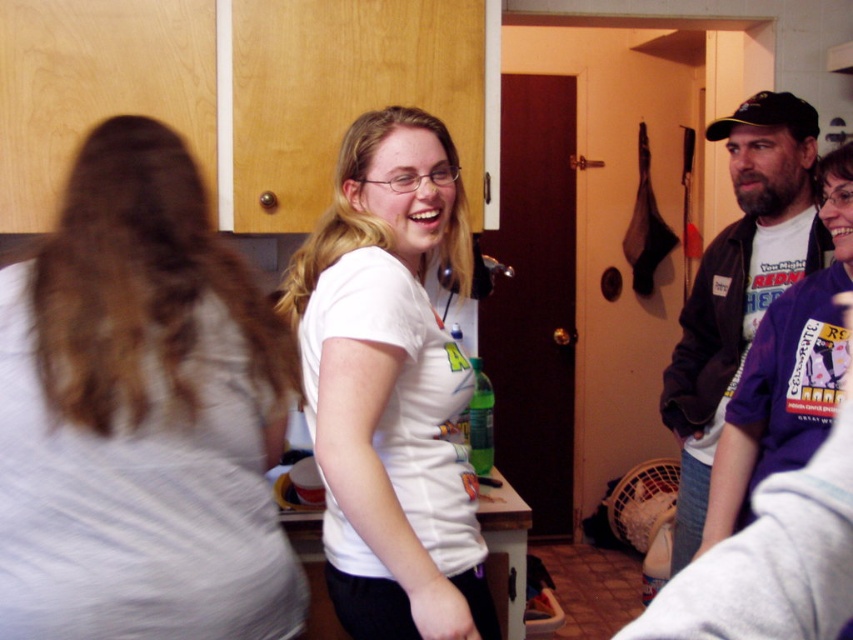
Question: Which object appears closest to the camera in this image?

Choices:
 (A) light gray cotton shirt at center
 (B) dark brown leather jacket at right
 (C) white matte t-shirt at center

Answer: (A)

Question: Is light gray cotton shirt at center bigger than white matte t-shirt at center?

Choices:
 (A) no
 (B) yes

Answer: (A)

Question: Which object is the farthest from the dark brown leather jacket at right?

Choices:
 (A) light gray cotton shirt at center
 (B) white matte t-shirt at center

Answer: (A)

Question: Which object appears farthest from the camera in this image?

Choices:
 (A) dark brown leather jacket at right
 (B) white matte t-shirt at center

Answer: (A)

Question: In this image, where is light gray cotton shirt at center located relative to dark brown leather jacket at right?

Choices:
 (A) left
 (B) right

Answer: (A)

Question: From the image, what is the correct spatial relationship of light gray cotton shirt at center in relation to dark brown leather jacket at right?

Choices:
 (A) left
 (B) right

Answer: (A)